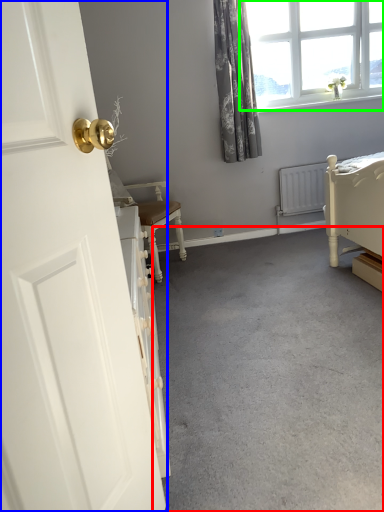
Question: Which object is positioned closest to concrete (highlighted by a red box)? Select from door (highlighted by a blue box) and window (highlighted by a green box).

Choices:
 (A) door
 (B) window

Answer: (A)